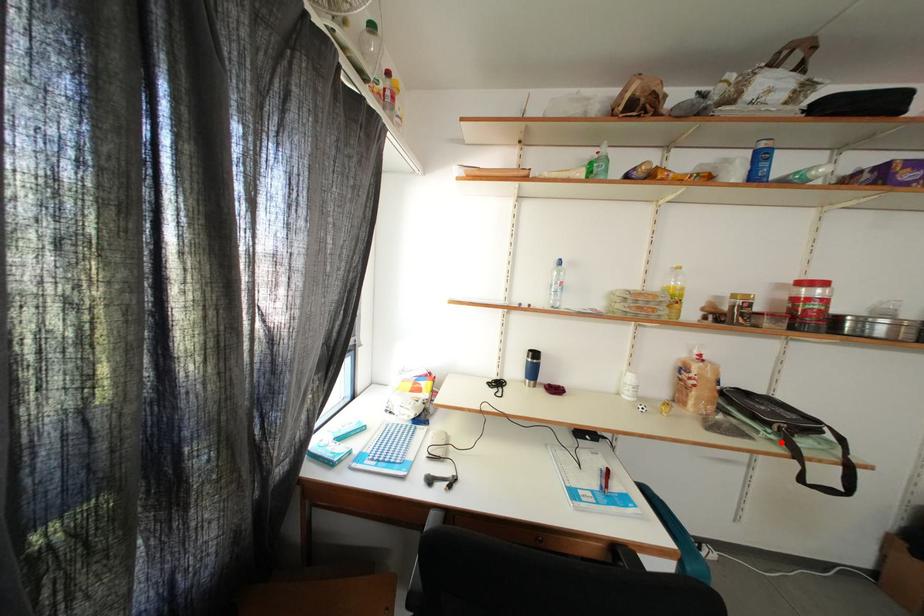
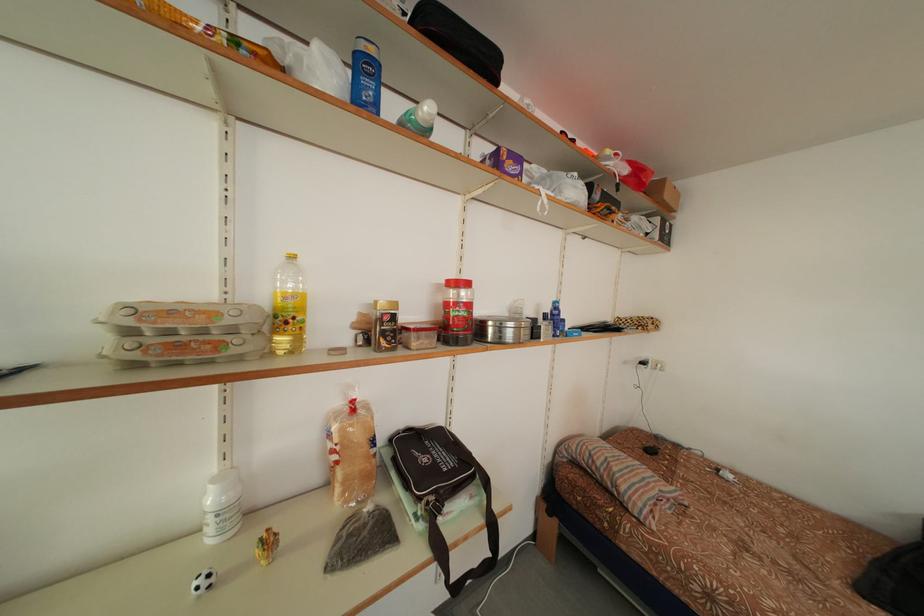
Locate, in the second image, the point that corresponds to the highlighted location in the first image.

(429, 531)